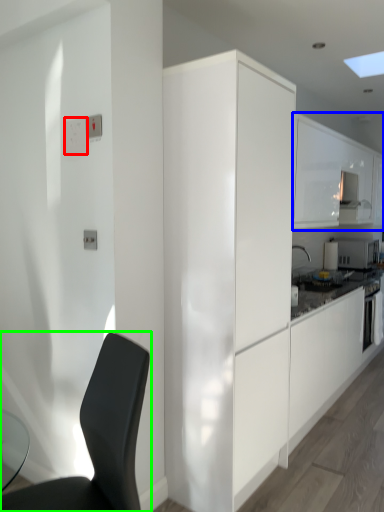
Question: Which object is the farthest from light switch (highlighted by a red box)? Choose among these: cabinetry (highlighted by a blue box) or chair (highlighted by a green box).

Choices:
 (A) cabinetry
 (B) chair

Answer: (A)